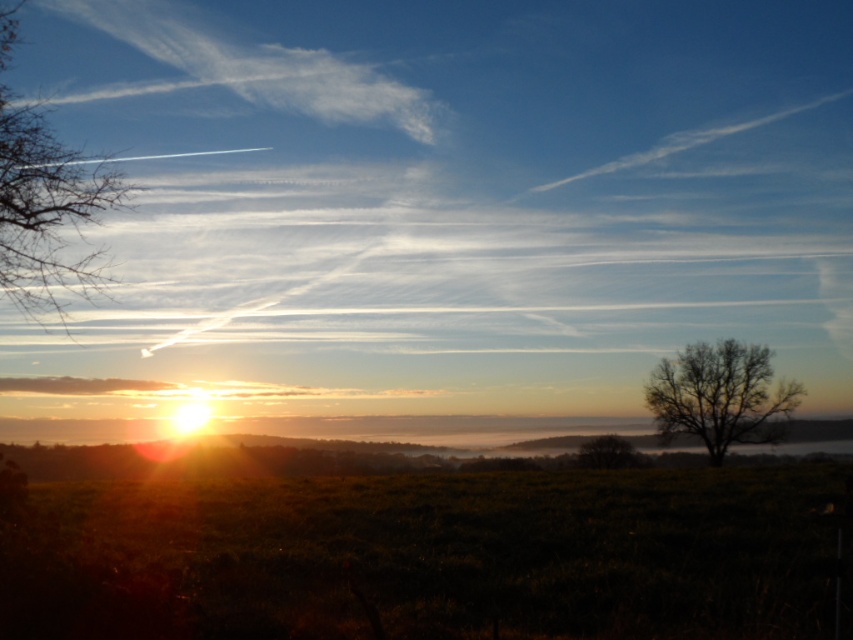
Between green grass at center and bare branches at left, which one appears on the left side from the viewer's perspective?

From the viewer's perspective, bare branches at left appears more on the left side.

Measure the distance between point (374, 564) and camera.

They are 10.20 meters apart.

Where is `green grass at center`? The height and width of the screenshot is (640, 853). green grass at center is located at coordinates (436, 556).

Can you confirm if bare branches at right is bigger than green matte tree at center?

Actually, bare branches at right might be smaller than green matte tree at center.

Can you confirm if bare branches at right is smaller than green matte tree at center?

Yes.

The height and width of the screenshot is (640, 853). I want to click on bare branches at right, so point(720,396).

Find the location of a particular element. The height and width of the screenshot is (640, 853). bare branches at right is located at coordinates (720, 396).

Is bare branches at left positioned behind bare branches at right?

No, bare branches at left is in front of bare branches at right.

Find the location of `bare branches at left`. bare branches at left is located at coordinates (44, 202).